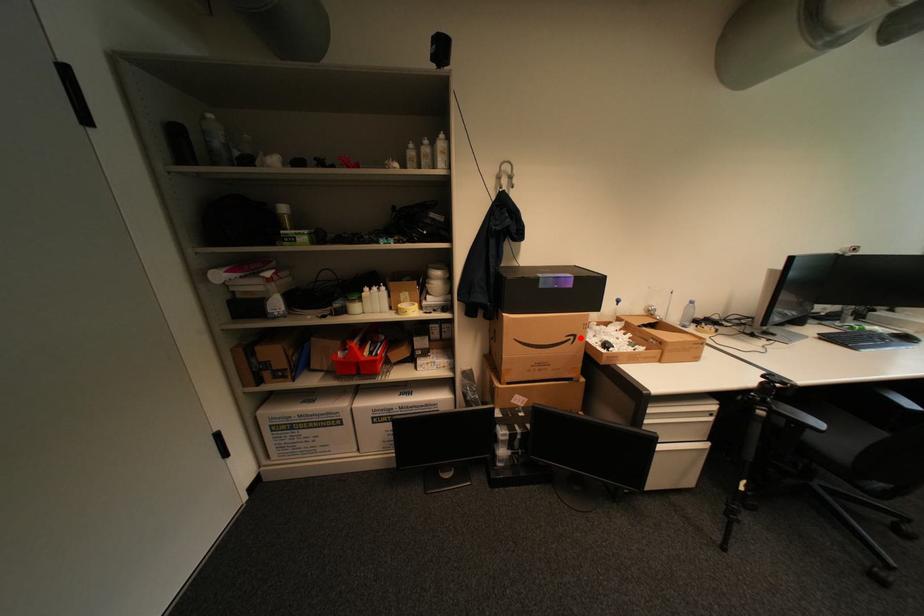
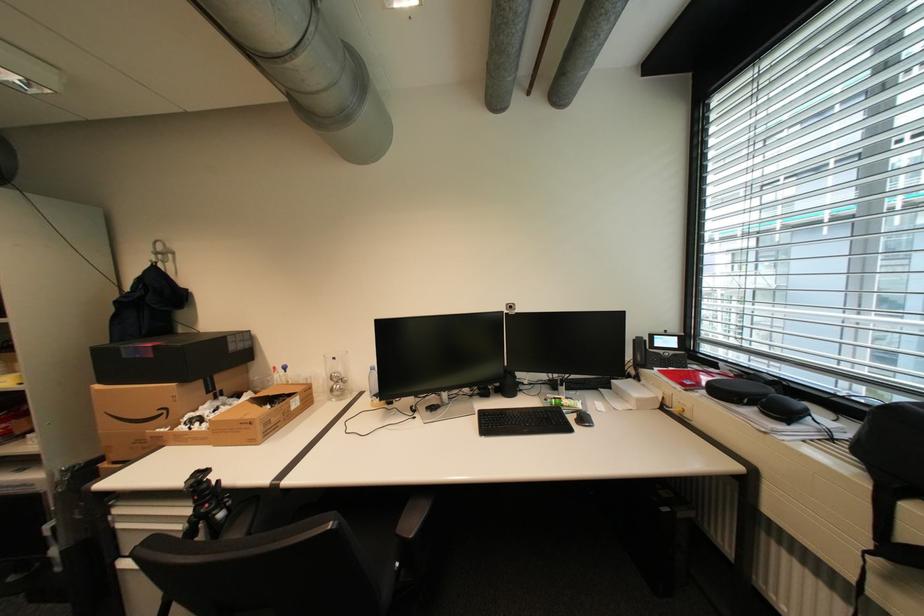
Locate, in the second image, the point that corresponds to the highlighted location in the first image.

(174, 411)